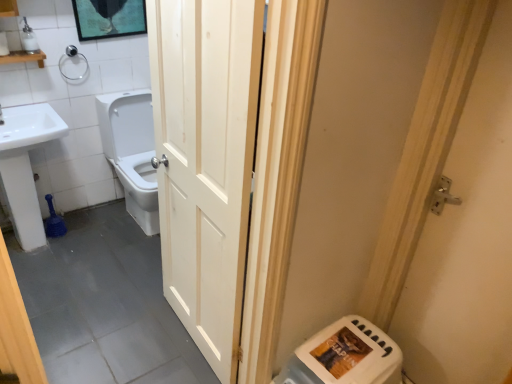
Locate an element on the screen. The image size is (512, 384). free space in front of white wood door at center, the first door when ordered from left to right is located at coordinates (181, 361).